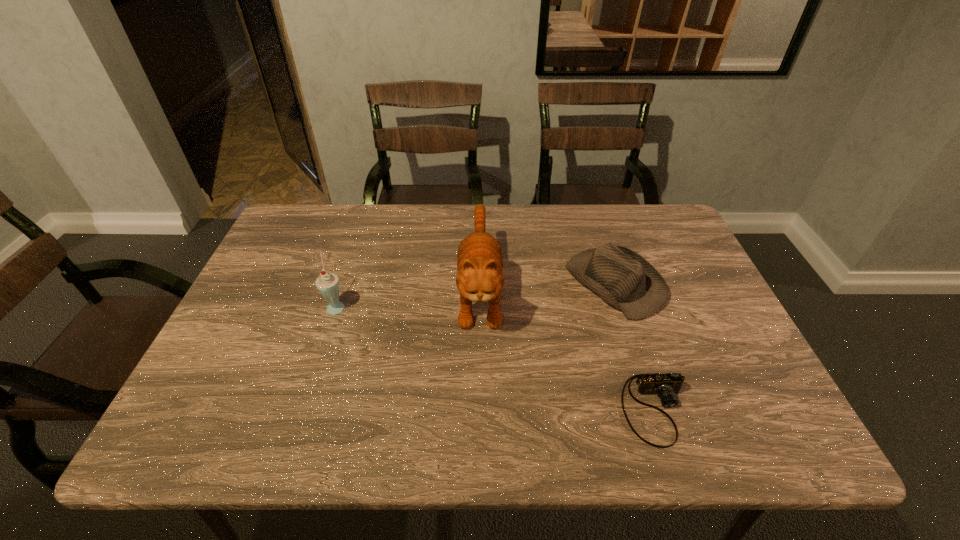
Where is `cat`? cat is located at coordinates (480, 260).

You are a GUI agent. You are given a task and a screenshot of the screen. Output one action in this format:
    pyautogui.click(x=<x>, y=<y>)
    Task: Click on the tallest object
    
    Given the screenshot: What is the action you would take?
    pyautogui.click(x=480, y=260)

At what (x,y) coordinates should I click in order to perform the action: click on the second tallest object. Please return your answer as a coordinate pair (x, y). Image resolution: width=960 pixels, height=540 pixels. Looking at the image, I should click on (327, 283).

Where is `milkshake`? milkshake is located at coordinates (327, 283).

Where is `the second shortest object`? the second shortest object is located at coordinates (626, 281).

At what (x,y) coordinates should I click in order to perform the action: click on camera. Please return your answer as a coordinate pair (x, y). This screenshot has width=960, height=540. Looking at the image, I should click on (666, 386).

In order to click on the nearest object in this screenshot , I will do `click(666, 386)`.

This screenshot has width=960, height=540. In order to click on free space located 0.050m on the face of the second object from left to right in this screenshot , I will do `click(480, 365)`.

Where is `vacant space located 0.080m on the straw side of the third shortest object`? vacant space located 0.080m on the straw side of the third shortest object is located at coordinates (378, 306).

You are a GUI agent. You are given a task and a screenshot of the screen. Output one action in this format:
    pyautogui.click(x=<x>, y=<y>)
    Task: Click on the free space located 0.260m on the left of the third tallest object
    The height and width of the screenshot is (540, 960).
    Given the screenshot: What is the action you would take?
    pyautogui.click(x=470, y=283)